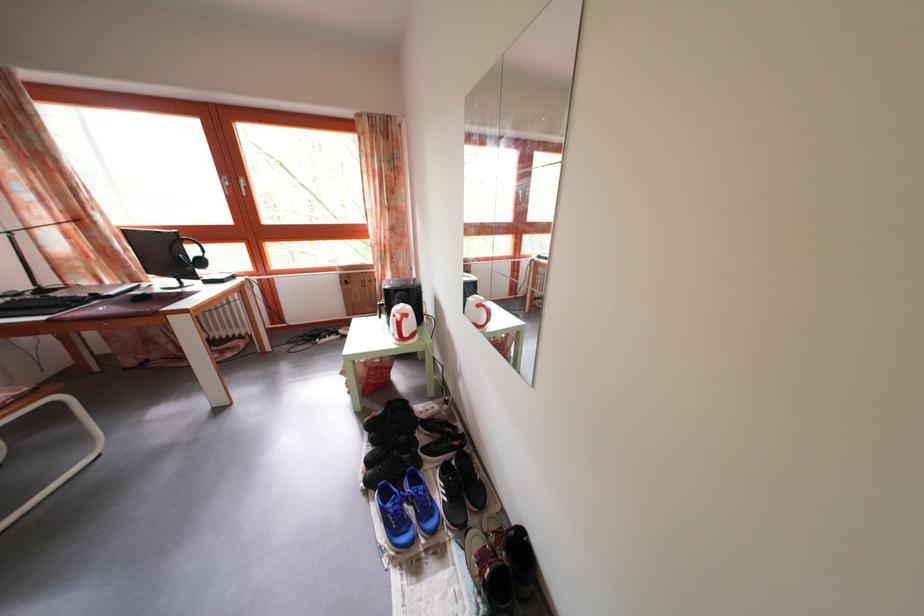
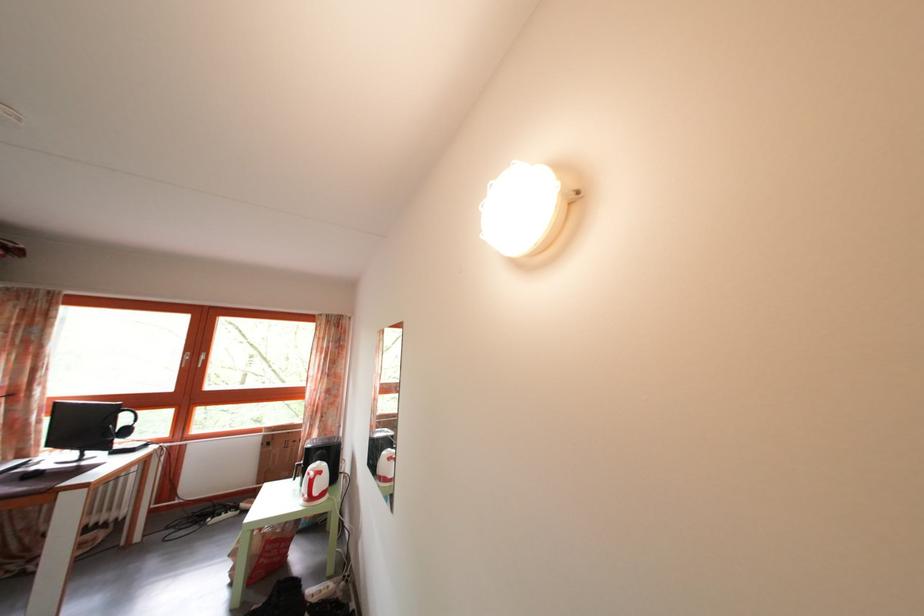
In the second image, find the point that corresponds to pixel 391 283 in the first image.

(317, 442)